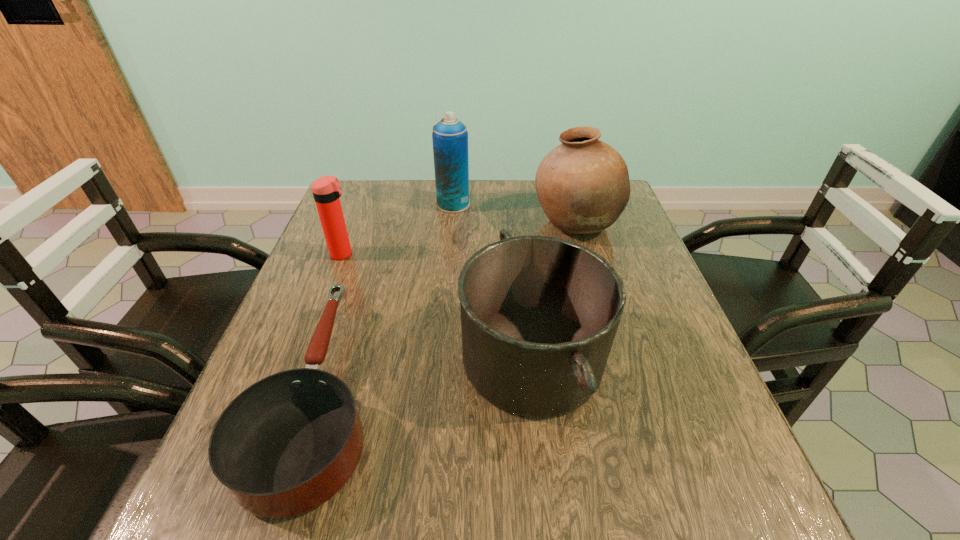
You are a GUI agent. You are given a task and a screenshot of the screen. Output one action in this format:
    pyautogui.click(x=<x>, y=<y>)
    Task: Click on the aerosol can
    Image resolution: width=960 pixels, height=540 pixels.
    Given the screenshot: What is the action you would take?
    pyautogui.click(x=450, y=136)

Where is `pottery`? pottery is located at coordinates (583, 186).

This screenshot has height=540, width=960. Identify the location of thermos bottle. (326, 190).

Locate an element on the screen. Image resolution: width=960 pixels, height=540 pixels. pan is located at coordinates (539, 314).

Locate an element on the screen. The height and width of the screenshot is (540, 960). pan is located at coordinates (288, 443).

At what (x,y) coordinates should I click in order to perform the action: click on vacant position located on the right of the aerosol can. Please return your answer as a coordinate pair (x, y). The height and width of the screenshot is (540, 960). Looking at the image, I should click on (596, 204).

Where is `vacant space situated 0.370m on the front of the pottery`? vacant space situated 0.370m on the front of the pottery is located at coordinates (615, 364).

Locate an element on the screen. This screenshot has height=540, width=960. vacant point located 0.110m on the right of the thermos bottle is located at coordinates (399, 254).

I want to click on free space located on the left of the pan, so click(x=420, y=359).

Image resolution: width=960 pixels, height=540 pixels. Identify the location of free point located 0.210m on the handle side of the shortest object. (365, 252).